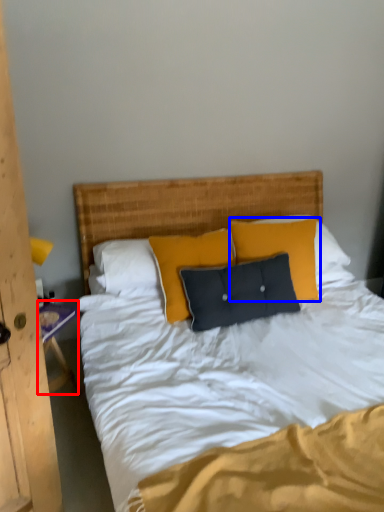
Question: Which object appears closest to the camera in this image, nightstand (highlighted by a red box) or pillow (highlighted by a blue box)?

Choices:
 (A) nightstand
 (B) pillow

Answer: (A)